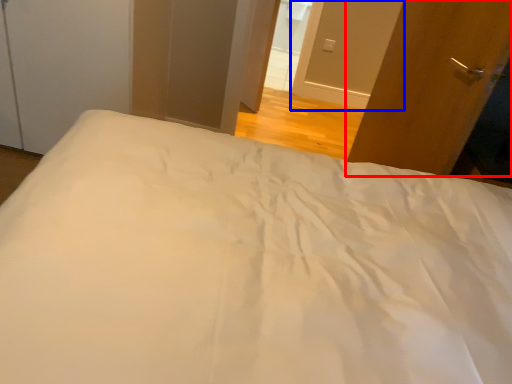
Question: Which point is closer to the camera, door (highlighted by a red box) or screen door (highlighted by a blue box)?

Choices:
 (A) door
 (B) screen door

Answer: (A)